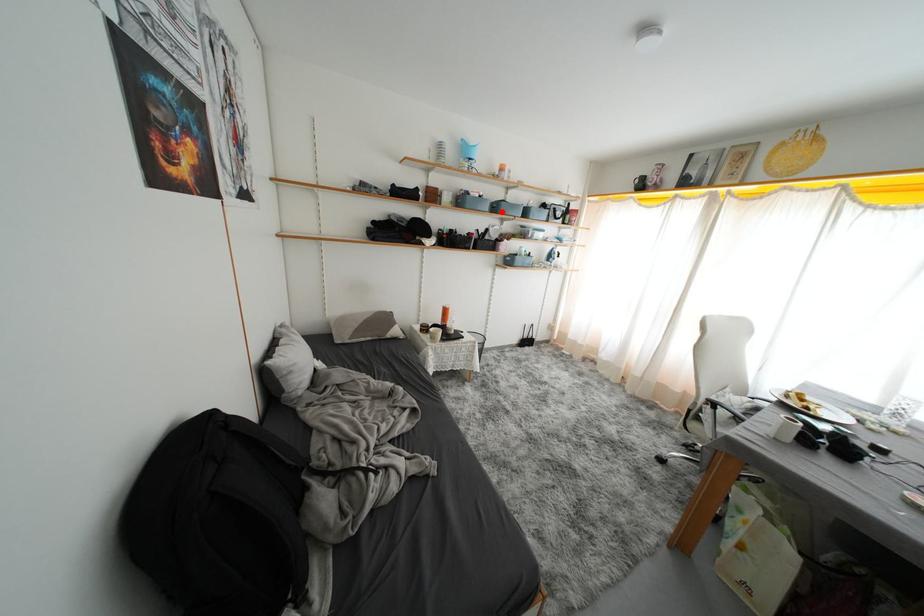
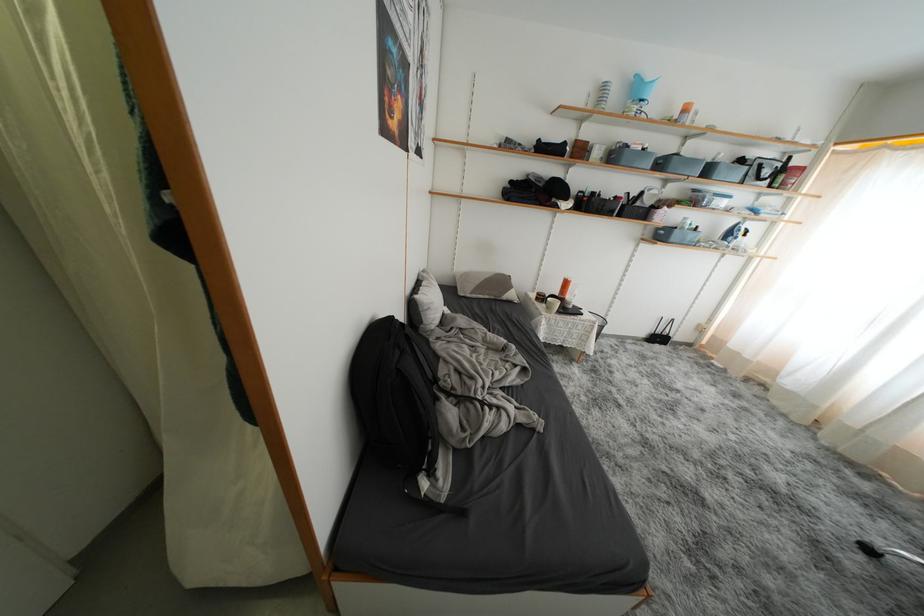
Question: I am providing you with two images of the same scene from different viewpoints. Image1 has a red point marked. In image2, the corresponding 3D location appears at what relative position? Reply with the corresponding letter.

Choices:
 (A) Closer
 (B) Farther

Answer: (B)